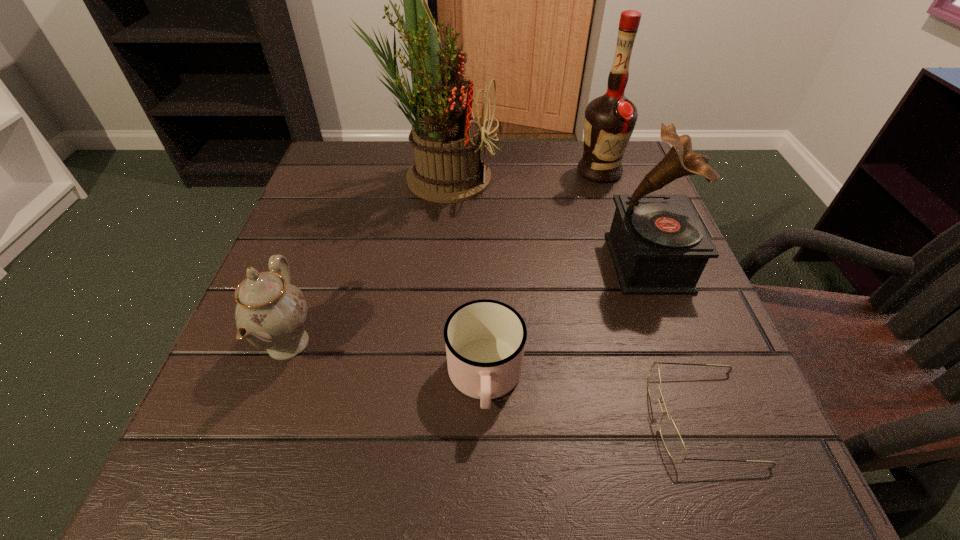
I want to click on the tallest object, so click(x=446, y=139).

Where is `the fifth shortest object`? the fifth shortest object is located at coordinates (609, 120).

Locate an element on the screen. This screenshot has height=540, width=960. the third farthest object is located at coordinates (659, 246).

The image size is (960, 540). I want to click on phonograph_record, so click(659, 246).

This screenshot has width=960, height=540. What are the coordinates of `the leftmost object` in the screenshot? It's located at point(270,313).

You are a GUI agent. You are given a task and a screenshot of the screen. Output one action in this format:
    pyautogui.click(x=<x>, y=<y>)
    Task: Click on the third shortest object
    Image resolution: width=960 pixels, height=540 pixels.
    Given the screenshot: What is the action you would take?
    pyautogui.click(x=270, y=313)

At what (x,y) coordinates should I click in order to perform the action: click on mug. Please return your answer as a coordinate pair (x, y). Looking at the image, I should click on (485, 339).

I want to click on spectacles, so click(x=672, y=440).

Locate an element on the screen. This screenshot has width=960, height=540. vacant space located 0.120m in front of the tallest object with the fan visible is located at coordinates (549, 177).

Where is `vacant area situated on the front and back of the liquor`? vacant area situated on the front and back of the liquor is located at coordinates tap(641, 300).